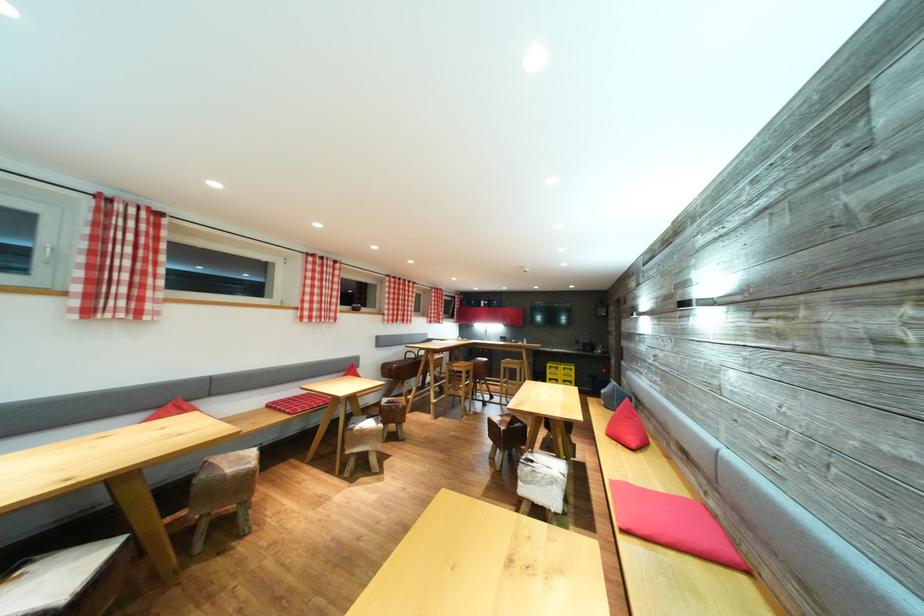
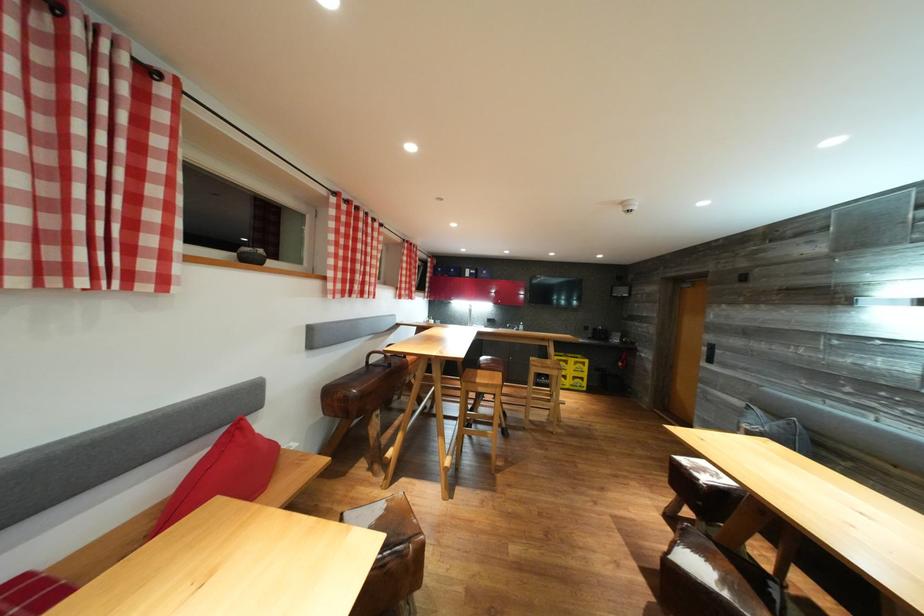
Locate, in the second image, the point that corresponds to point 321,326 in the first image.

(23, 286)